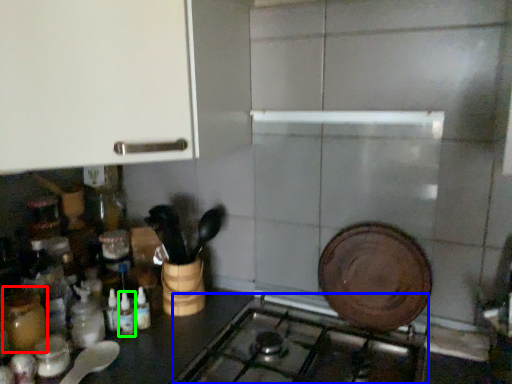
Question: Which object is the closest to the bottle (highlighted by a red box)? Choose among these: gas stove (highlighted by a blue box) or bottle (highlighted by a green box).

Choices:
 (A) gas stove
 (B) bottle

Answer: (B)